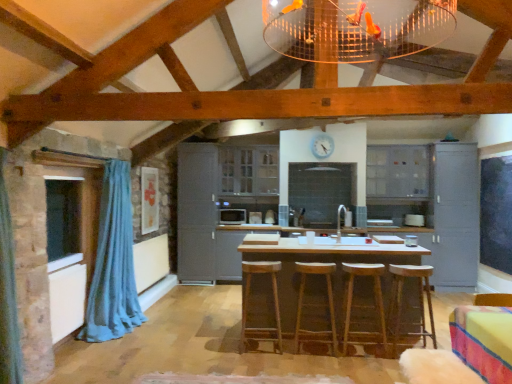
Where is `vacant location below wooden bar stool at center, arranged as the 3th bar stool when viewed from the right (from a real-world perspective)`? vacant location below wooden bar stool at center, arranged as the 3th bar stool when viewed from the right (from a real-world perspective) is located at coordinates (312, 351).